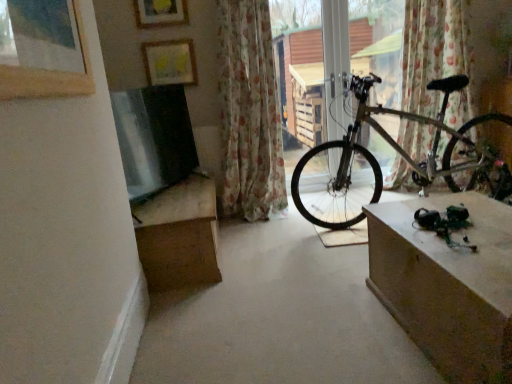
Question: Should I look upward or downward to see matte yellow picture frame at upper center, the second picture frame from the top?

Choices:
 (A) up
 (B) down

Answer: (A)

Question: From the image's perspective, is floral fabric curtain at right, which ranks as the 2th curtain in left-to-right order, under concretesmoothconcrete at center?

Choices:
 (A) yes
 (B) no

Answer: (B)

Question: Is floral fabric curtain at right, which appears as the 1th curtain when viewed from the right, bigger than concretesmoothconcrete at center?

Choices:
 (A) no
 (B) yes

Answer: (A)

Question: Does floral fabric curtain at right, which ranks as the 2th curtain in left-to-right order, come behind concretesmoothconcrete at center?

Choices:
 (A) no
 (B) yes

Answer: (B)

Question: From a real-world perspective, is floral fabric curtain at right, which appears as the 1th curtain when viewed from the right, physically above concretesmoothconcrete at center?

Choices:
 (A) yes
 (B) no

Answer: (A)

Question: Can you confirm if floral fabric curtain at right, which appears as the 1th curtain when viewed from the right, is positioned to the right of concretesmoothconcrete at center?

Choices:
 (A) yes
 (B) no

Answer: (A)

Question: Is floral fabric curtain at right, which appears as the 1th curtain when viewed from the right, smaller than concretesmoothconcrete at center?

Choices:
 (A) yes
 (B) no

Answer: (A)

Question: Considering the relative sizes of wooden picture frame at upper left, the 1th picture frame from the bottom, and floral fabric curtain at right, which appears as the 1th curtain when viewed from the right, in the image provided, is wooden picture frame at upper left, the 1th picture frame from the bottom, smaller than floral fabric curtain at right, which appears as the 1th curtain when viewed from the right,?

Choices:
 (A) no
 (B) yes

Answer: (B)

Question: Is floral fabric curtain at right, which appears as the 1th curtain when viewed from the right, surrounded by wooden picture frame at upper left, the 3th picture frame when ordered from top to bottom?

Choices:
 (A) no
 (B) yes

Answer: (A)

Question: Is wooden picture frame at upper left, the first picture frame positioned from the front, taller than floral fabric curtain at right, which appears as the 1th curtain when viewed from the right?

Choices:
 (A) no
 (B) yes

Answer: (A)

Question: Does wooden picture frame at upper left, the 3th picture frame when ordered from top to bottom, have a greater width compared to floral fabric curtain at right, which appears as the 1th curtain when viewed from the right?

Choices:
 (A) yes
 (B) no

Answer: (B)

Question: Is wooden picture frame at upper left, placed as the 3th picture frame when sorted from back to front, thinner than floral fabric curtain at right, which appears as the 1th curtain when viewed from the right?

Choices:
 (A) yes
 (B) no

Answer: (A)

Question: Would you say wooden picture frame at upper left, the first picture frame positioned from the front, is a long distance from floral fabric curtain at right, which appears as the 1th curtain when viewed from the right?

Choices:
 (A) no
 (B) yes

Answer: (B)

Question: Is metallic silver bicycle at center surrounded by concretesmoothconcrete at center?

Choices:
 (A) yes
 (B) no

Answer: (B)